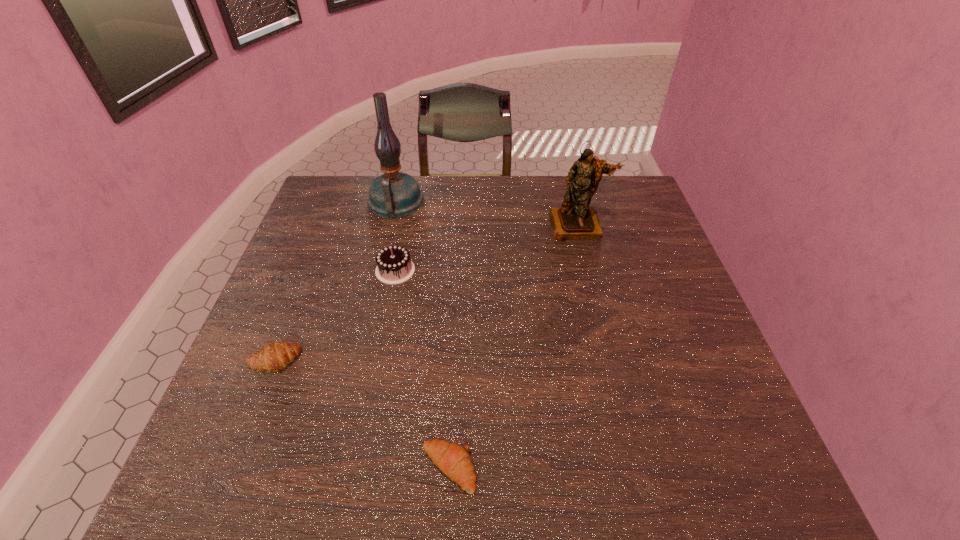
In order to click on the tallest object in this screenshot , I will do `click(394, 194)`.

The width and height of the screenshot is (960, 540). Find the location of `the fourth shortest object`. the fourth shortest object is located at coordinates (575, 219).

Where is `the rightmost object`? the rightmost object is located at coordinates (575, 219).

What are the coordinates of `the third tallest object` in the screenshot? It's located at (394, 266).

The height and width of the screenshot is (540, 960). What are the coordinates of `chocolate cake` in the screenshot? It's located at 394,266.

Where is `the fourth tallest object`? the fourth tallest object is located at coordinates (276, 356).

Identify the location of the leftmost object. point(276,356).

Where is `the fourth object from left to right`? the fourth object from left to right is located at coordinates (453, 460).

This screenshot has height=540, width=960. What are the coordinates of `the shortest object` in the screenshot? It's located at (453, 460).

Image resolution: width=960 pixels, height=540 pixels. Identify the location of vacant space located 0.400m on the right of the tallest object. (551, 202).